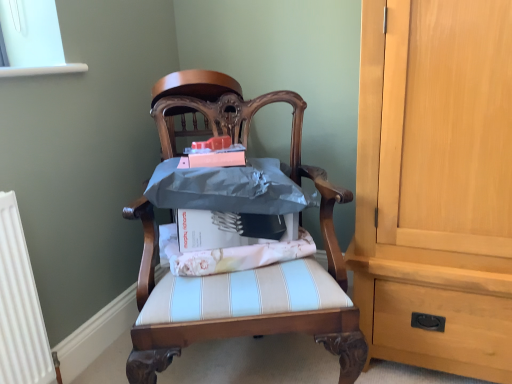
Question: Which direction should I rotate to face wooden chair at center, which appears as the first chair when ordered from the bottom, — up or down?

Choices:
 (A) down
 (B) up

Answer: (A)

Question: Is metallic blue cushion at center, which is the second chair from bottom to top, not within wooden chair at center, which appears as the first chair when ordered from the bottom?

Choices:
 (A) no
 (B) yes

Answer: (B)

Question: Is metallic blue cushion at center, which is the second chair from bottom to top, positioned in front of wooden chair at center, which is the second chair in top-to-bottom order?

Choices:
 (A) yes
 (B) no

Answer: (B)

Question: From a real-world perspective, is metallic blue cushion at center, which is the second chair from bottom to top, on top of wooden chair at center, which is the second chair in top-to-bottom order?

Choices:
 (A) no
 (B) yes

Answer: (B)

Question: Is metallic blue cushion at center, which is the second chair from bottom to top, at the left side of wooden chair at center, which appears as the first chair when ordered from the bottom?

Choices:
 (A) yes
 (B) no

Answer: (A)

Question: Can you confirm if metallic blue cushion at center, the 1th chair in the top-to-bottom sequence, is positioned to the right of wooden chair at center, which appears as the first chair when ordered from the bottom?

Choices:
 (A) no
 (B) yes

Answer: (A)

Question: Considering the relative sizes of metallic blue cushion at center, the 1th chair in the top-to-bottom sequence, and wooden chair at center, which is the second chair in top-to-bottom order, in the image provided, is metallic blue cushion at center, the 1th chair in the top-to-bottom sequence, thinner than wooden chair at center, which is the second chair in top-to-bottom order,?

Choices:
 (A) no
 (B) yes

Answer: (B)

Question: Is wooden chair at center, which appears as the first chair when ordered from the bottom, bigger than white striped fabric at center?

Choices:
 (A) no
 (B) yes

Answer: (B)

Question: Is wooden chair at center, which is the second chair in top-to-bottom order, further to the viewer compared to white striped fabric at center?

Choices:
 (A) no
 (B) yes

Answer: (A)

Question: Does wooden chair at center, which appears as the first chair when ordered from the bottom, have a greater height compared to white striped fabric at center?

Choices:
 (A) yes
 (B) no

Answer: (A)

Question: Is white striped fabric at center a part of wooden chair at center, which is the second chair in top-to-bottom order?

Choices:
 (A) yes
 (B) no

Answer: (A)

Question: Can you confirm if wooden chair at center, which is the second chair in top-to-bottom order, is thinner than white striped fabric at center?

Choices:
 (A) no
 (B) yes

Answer: (A)

Question: Does wooden chair at center, which is the second chair in top-to-bottom order, lie in front of white striped fabric at center?

Choices:
 (A) yes
 (B) no

Answer: (A)

Question: Considering the relative positions of wooden chair at center, which is the second chair in top-to-bottom order, and metallic blue cushion at center, which is the second chair from bottom to top, in the image provided, is wooden chair at center, which is the second chair in top-to-bottom order, to the right of metallic blue cushion at center, which is the second chair from bottom to top, from the viewer's perspective?

Choices:
 (A) no
 (B) yes

Answer: (B)